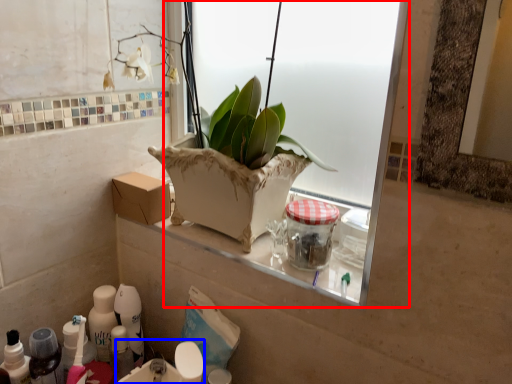
Question: Which object appears closest to the camera in this image, window (highlighted by a red box) or sink (highlighted by a blue box)?

Choices:
 (A) window
 (B) sink

Answer: (A)